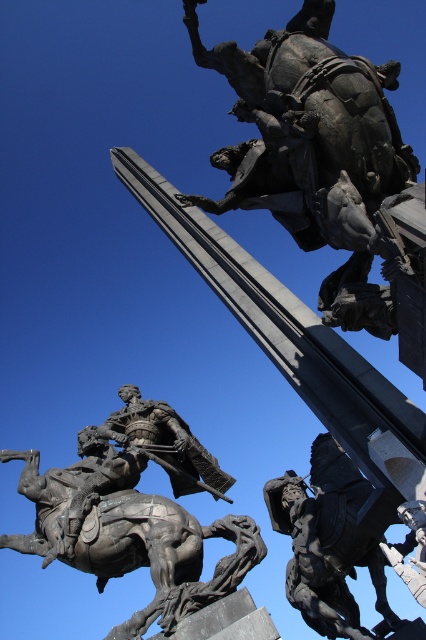
Does bronze statue at upper center have a greater width compared to bronze textured horse at lower left?

No.

Is point (328, 74) farther from viewer compared to point (250, 556)?

No, (328, 74) is in front of (250, 556).

The height and width of the screenshot is (640, 426). Identify the location of bronze statue at upper center. (314, 150).

Locate an element on the screen. bronze statue at upper center is located at coordinates (314, 150).

Is bronze statue at center above polished bronze rider at center?

No, bronze statue at center is not above polished bronze rider at center.

Can you confirm if bronze statue at center is positioned to the right of polished bronze rider at center?

Correct, you'll find bronze statue at center to the right of polished bronze rider at center.

Is point (347, 609) positioned after point (163, 422)?

No, (347, 609) is closer to viewer.

Find the location of a particular element. This screenshot has height=640, width=426. bronze statue at center is located at coordinates (328, 541).

Can you confirm if bronze textured horse at lower left is taller than bronze statue at center?

In fact, bronze textured horse at lower left may be shorter than bronze statue at center.

In the scene shown: Between bronze textured horse at lower left and bronze statue at center, which one appears on the left side from the viewer's perspective?

bronze textured horse at lower left

Does point (218, 584) lie behind point (308, 520)?

No.

The image size is (426, 640). What are the coordinates of `bronze textured horse at lower left` in the screenshot? It's located at (161, 554).